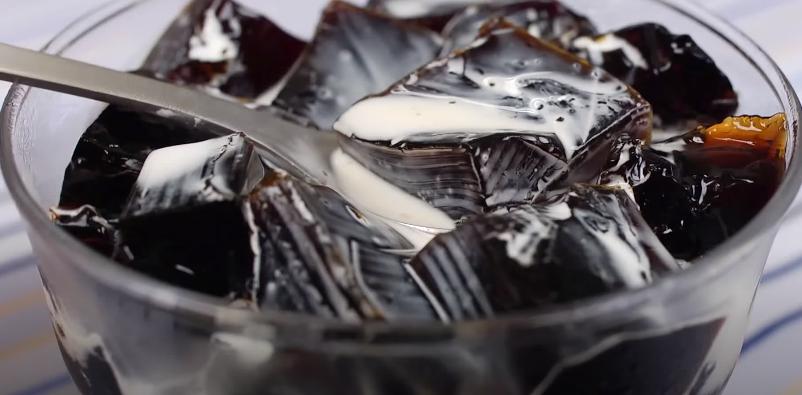
Where is `utensil handle`? The width and height of the screenshot is (802, 395). utensil handle is located at coordinates pos(134,87).